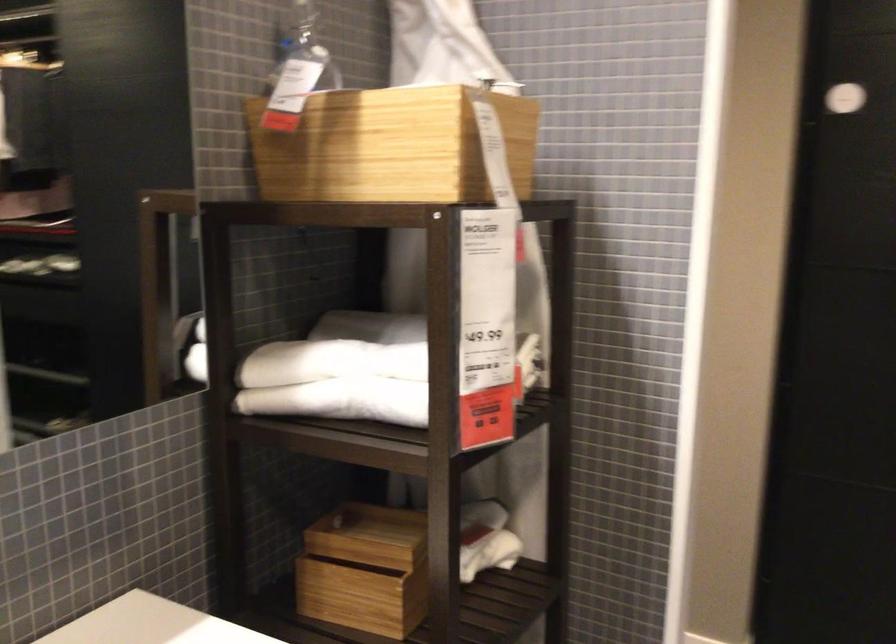
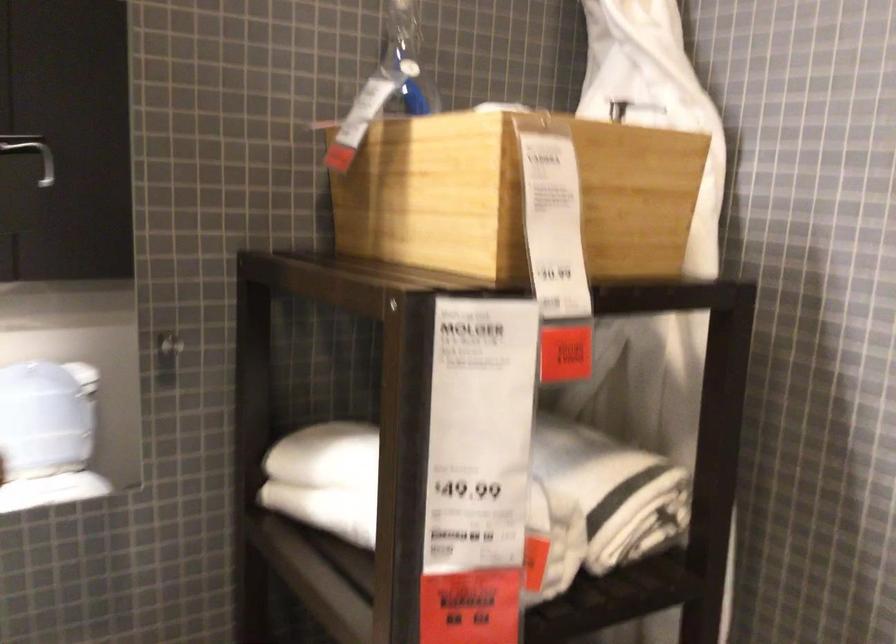
Question: The images are taken continuously from a first-person perspective. In which direction is your viewpoint rotating?

Choices:
 (A) Left
 (B) Right
 (C) Up
 (D) Down

Answer: (A)